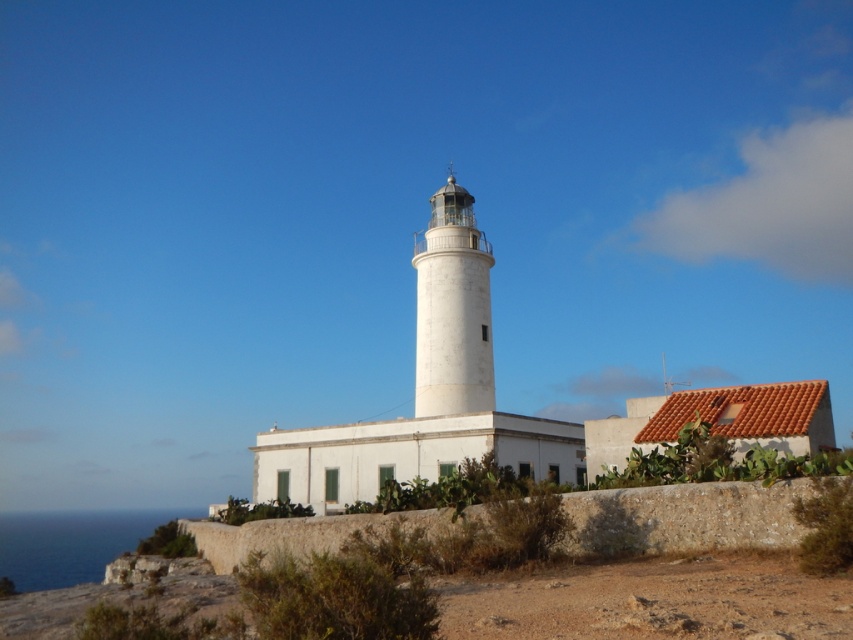
Does point (647, 522) lie behind point (471, 234)?

No, (647, 522) is closer to viewer.

The height and width of the screenshot is (640, 853). Describe the element at coordinates (683, 516) in the screenshot. I see `brown rough stone wall at lower center` at that location.

This screenshot has width=853, height=640. Find the location of `brown rough stone wall at lower center`. brown rough stone wall at lower center is located at coordinates (683, 516).